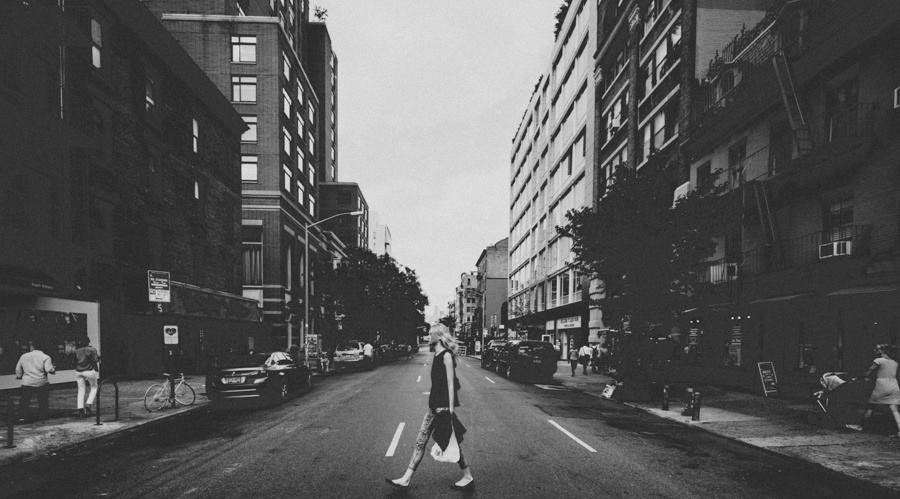
Locate an element on the screen. The image size is (900, 499). light is located at coordinates [x=360, y=207].